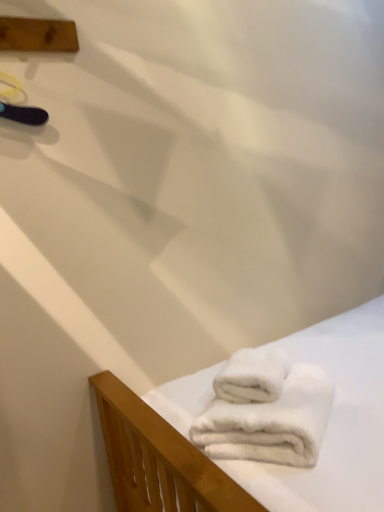
Question: From their relative heights in the image, would you say white fluffy towel at lower right, which is the 1th towel from top to bottom, is taller or shorter than wooden plank at upper left?

Choices:
 (A) tall
 (B) short

Answer: (B)

Question: Considering their positions, is white fluffy towel at lower right, acting as the second towel starting from the bottom, located in front of or behind wooden plank at upper left?

Choices:
 (A) front
 (B) behind

Answer: (A)

Question: Which object is positioned closest to the white fluffy towel at lower right, acting as the second towel starting from the bottom?

Choices:
 (A) white fluffy towels at lower right, which ranks as the first towel in bottom-to-top order
 (B) wooden plank at upper left

Answer: (A)

Question: Considering the real-world distances, which object is farthest from the white fluffy towels at lower right, positioned as the second towel in top-to-bottom order?

Choices:
 (A) white fluffy towel at lower right, which is the 1th towel from top to bottom
 (B) wooden plank at upper left

Answer: (B)